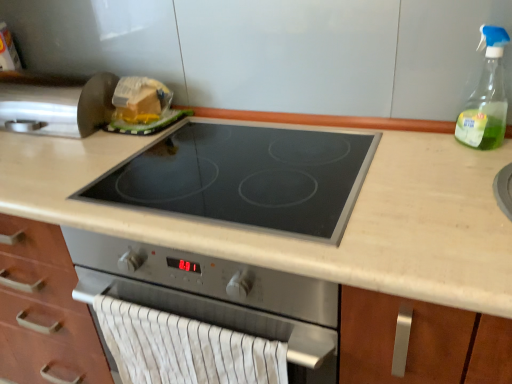
Image resolution: width=512 pixels, height=384 pixels. Identify the location of vacant area that is in front of clear glass spray bottle at upper right. (481, 170).